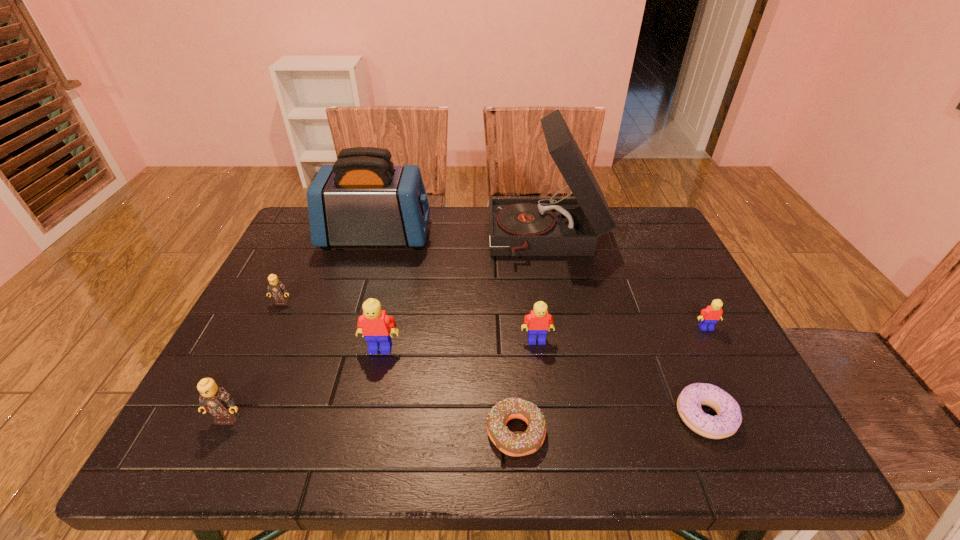
I want to click on object that is the third nearest to the farthest Lego, so click(x=214, y=399).

At what (x,y) coordinates should I click in order to perform the action: click on the closest Lego relative to the seventh shortest object. Please return your answer as a coordinate pair (x, y). Looking at the image, I should click on (276, 289).

Find the location of a particular element. This screenshot has width=960, height=540. Lego identified as the third closest to the rightmost Lego is located at coordinates (276, 289).

Identify the location of yellow Lego that is the second closest to the farther tan Lego. The height and width of the screenshot is (540, 960). (539, 321).

The image size is (960, 540). Find the location of `the closest yellow Lego to the biggest yellow Lego`. the closest yellow Lego to the biggest yellow Lego is located at coordinates (539, 321).

What are the coordinates of `free space that satisfies the following two spatial constraints: 1. on the front-facing side of the phonograph_record; 2. in front of the nearer tan Lego` in the screenshot? It's located at (582, 418).